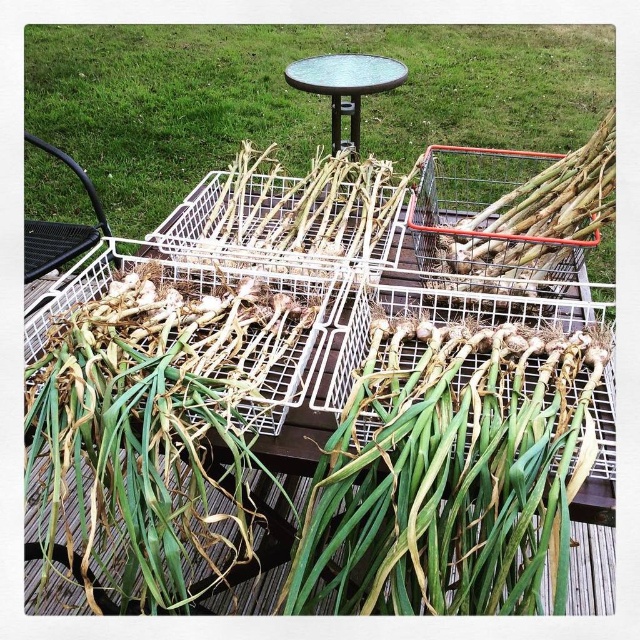
Does green leafy grass at center have a lesser height compared to green glass table at center?

Indeed, green leafy grass at center has a lesser height compared to green glass table at center.

Does point (269, 33) come in front of point (406, 76)?

No, it is behind (406, 76).

Which is in front, point (193, 134) or point (292, 76)?

Point (292, 76) is in front.

Identify the location of green leafy grass at center. The image size is (640, 640). (296, 97).